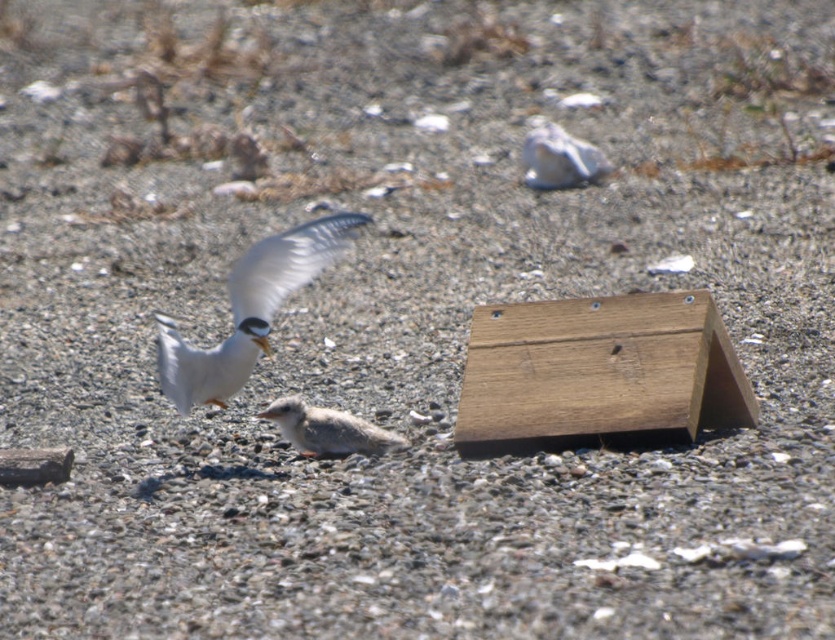
You are a wildlife photographer trying to capture both the white feathered bird at center and the gray downy chick at center in a single frame. Given their sizes, which bird should you focus on to ensure both are clearly visible in your photo?

The white feathered bird at center is larger than the gray downy chick at center, so focusing on the white feathered bird at center will help ensure both are clearly visible in the photo.

You are a delivery robot that needs to place a package in the brown wooden box at center without disturbing the gray downy chick at center. The robot is 12 inches wide. Is there enough space between them to safely maneuver?

The brown wooden box at center and gray downy chick at center are 24.78 inches apart from each other. Since the robot is 12 inches wide, there is sufficient space to maneuver safely between them as the distance is more than double the robot width.